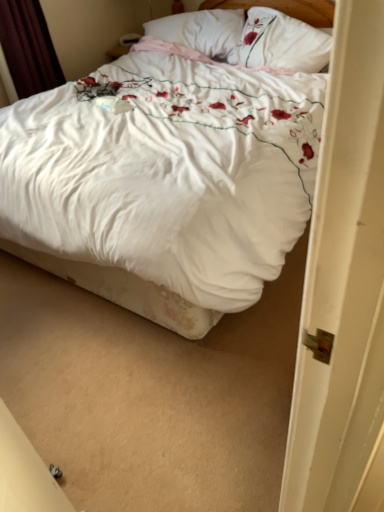
Identify the location of white floral pillow at upper center, which ranks as the second pillow in left-to-right order. The image size is (384, 512). (282, 42).

Describe the element at coordinates (282, 42) in the screenshot. This screenshot has width=384, height=512. I see `white floral pillow at upper center, placed as the first pillow when sorted from right to left` at that location.

The width and height of the screenshot is (384, 512). Find the location of `dark red velvet curtain at upper left`. dark red velvet curtain at upper left is located at coordinates (28, 47).

Find the location of a particular element. white soft pillow at upper center, which appears as the second pillow when viewed from the right is located at coordinates (202, 32).

Are white floral duvet at center and white floral pillow at upper center, which ranks as the second pillow in left-to-right order, beside each other?

No, white floral duvet at center is not with white floral pillow at upper center, which ranks as the second pillow in left-to-right order.

Is point (142, 312) in front of point (261, 41)?

Yes, it is in front of point (261, 41).

Can we say white floral duvet at center lies outside white floral pillow at upper center, which ranks as the second pillow in left-to-right order?

Yes.

Between white floral duvet at center and white soft pillow at upper center, which is the 1th pillow in left-to-right order, which one appears on the right side from the viewer's perspective?

white soft pillow at upper center, which is the 1th pillow in left-to-right order, is more to the right.

Considering the relative positions of white floral duvet at center and white soft pillow at upper center, which is the 1th pillow in left-to-right order, in the image provided, is white floral duvet at center in front of white soft pillow at upper center, which is the 1th pillow in left-to-right order,?

Yes, white floral duvet at center is in front of white soft pillow at upper center, which is the 1th pillow in left-to-right order.

From a real-world perspective, is white floral duvet at center physically located above or below white soft pillow at upper center, which appears as the second pillow when viewed from the right?

white floral duvet at center is below white soft pillow at upper center, which appears as the second pillow when viewed from the right.

Consider the image. Does white floral duvet at center have a lesser height compared to white soft pillow at upper center, which is the 1th pillow in left-to-right order?

Incorrect, the height of white floral duvet at center does not fall short of that of white soft pillow at upper center, which is the 1th pillow in left-to-right order.

Does white soft pillow at upper center, which is the 1th pillow in left-to-right order, turn towards dark red velvet curtain at upper left?

No, white soft pillow at upper center, which is the 1th pillow in left-to-right order, is not aimed at dark red velvet curtain at upper left.

Is the surface of white soft pillow at upper center, which is the 1th pillow in left-to-right order, in direct contact with dark red velvet curtain at upper left?

No, white soft pillow at upper center, which is the 1th pillow in left-to-right order, is not making contact with dark red velvet curtain at upper left.

Find the location of `curtain that is on the left side of white soft pillow at upper center, which appears as the second pillow when viewed from the right`. curtain that is on the left side of white soft pillow at upper center, which appears as the second pillow when viewed from the right is located at coordinates (28, 47).

From the image's perspective, is white soft pillow at upper center, which is the 1th pillow in left-to-right order, positioned above or below white floral duvet at center?

white soft pillow at upper center, which is the 1th pillow in left-to-right order, is above white floral duvet at center.

Is white soft pillow at upper center, which is the 1th pillow in left-to-right order, far away from white floral duvet at center?

white soft pillow at upper center, which is the 1th pillow in left-to-right order, is positioned a significant distance from white floral duvet at center.

Looking at this image, which object is further away from the camera, white soft pillow at upper center, which is the 1th pillow in left-to-right order, or white floral duvet at center?

white soft pillow at upper center, which is the 1th pillow in left-to-right order, is behind.

Does white soft pillow at upper center, which appears as the second pillow when viewed from the right, have a lesser height compared to white floral duvet at center?

Yes, white soft pillow at upper center, which appears as the second pillow when viewed from the right, is shorter than white floral duvet at center.

Where is `pillow lying above the white floral pillow at upper center, which ranks as the second pillow in left-to-right order (from the image's perspective)`? This screenshot has width=384, height=512. pillow lying above the white floral pillow at upper center, which ranks as the second pillow in left-to-right order (from the image's perspective) is located at coordinates (202, 32).

Does white soft pillow at upper center, which appears as the second pillow when viewed from the right, have a greater width compared to white floral pillow at upper center, placed as the first pillow when sorted from right to left?

Yes.

Is white soft pillow at upper center, which is the 1th pillow in left-to-right order, closer to the viewer compared to white floral pillow at upper center, which ranks as the second pillow in left-to-right order?

That is False.

Which is behind, point (34, 33) or point (309, 12)?

Point (34, 33)

Does dark red velvet curtain at upper left have a greater height compared to white floral duvet at center?

Incorrect, the height of dark red velvet curtain at upper left is not larger of that of white floral duvet at center.

Would you say dark red velvet curtain at upper left contains white floral duvet at center?

That's incorrect, white floral duvet at center is not inside dark red velvet curtain at upper left.

From a real-world perspective, is dark red velvet curtain at upper left over white floral duvet at center?

Yes, from a real-world perspective, dark red velvet curtain at upper left is above white floral duvet at center.

From a real-world perspective, is white floral pillow at upper center, which ranks as the second pillow in left-to-right order, above or below dark red velvet curtain at upper left?

From a real-world perspective, white floral pillow at upper center, which ranks as the second pillow in left-to-right order, is physically above dark red velvet curtain at upper left.

Where is `curtain that appears behind the white floral pillow at upper center, which ranks as the second pillow in left-to-right order`? curtain that appears behind the white floral pillow at upper center, which ranks as the second pillow in left-to-right order is located at coordinates (28, 47).

Which is behind, point (311, 42) or point (9, 68)?

Positioned behind is point (9, 68).

Can you confirm if white floral pillow at upper center, which ranks as the second pillow in left-to-right order, is bigger than dark red velvet curtain at upper left?

No.

You are a GUI agent. You are given a task and a screenshot of the screen. Output one action in this format:
    pyautogui.click(x=<x>, y=<y>)
    Task: Click on the bed that is in front of the white floral pillow at upper center, placed as the first pillow when sorted from right to left
    
    Given the screenshot: What is the action you would take?
    pyautogui.click(x=125, y=292)

Locate an element on the screen. Image resolution: width=384 pixels, height=512 pixels. the 2nd pillow positioned above the white floral duvet at center (from the image's perspective) is located at coordinates (202, 32).

Considering their positions, is white soft pillow at upper center, which is the 1th pillow in left-to-right order, positioned closer to white floral duvet at center than white floral pillow at upper center, which ranks as the second pillow in left-to-right order?

white floral pillow at upper center, which ranks as the second pillow in left-to-right order, is positioned closer to the anchor white floral duvet at center.

Looking at the image, which one is located further to white floral duvet at center, dark red velvet curtain at upper left or white floral pillow at upper center, placed as the first pillow when sorted from right to left?

Among the two, white floral pillow at upper center, placed as the first pillow when sorted from right to left, is located further to white floral duvet at center.

Based on the photo, considering their positions, is white floral duvet at center positioned further to white soft pillow at upper center, which appears as the second pillow when viewed from the right, than dark red velvet curtain at upper left?

Among the two, white floral duvet at center is located further to white soft pillow at upper center, which appears as the second pillow when viewed from the right.

From the picture: From the image, which object appears to be nearer to white floral duvet at center, white soft pillow at upper center, which is the 1th pillow in left-to-right order, or dark red velvet curtain at upper left?

Among the two, dark red velvet curtain at upper left is located nearer to white floral duvet at center.

When comparing their distances from dark red velvet curtain at upper left, does white floral duvet at center or white soft pillow at upper center, which appears as the second pillow when viewed from the right, seem closer?

white soft pillow at upper center, which appears as the second pillow when viewed from the right, is closer to dark red velvet curtain at upper left.

Which object lies nearer to the anchor point dark red velvet curtain at upper left, white soft pillow at upper center, which is the 1th pillow in left-to-right order, or white floral duvet at center?

Based on the image, white soft pillow at upper center, which is the 1th pillow in left-to-right order, appears to be nearer to dark red velvet curtain at upper left.

Considering their positions, is white soft pillow at upper center, which is the 1th pillow in left-to-right order, positioned closer to white floral pillow at upper center, placed as the first pillow when sorted from right to left, than dark red velvet curtain at upper left?

Among the two, white soft pillow at upper center, which is the 1th pillow in left-to-right order, is located nearer to white floral pillow at upper center, placed as the first pillow when sorted from right to left.

Considering their positions, is dark red velvet curtain at upper left positioned closer to white soft pillow at upper center, which is the 1th pillow in left-to-right order, than white floral duvet at center?

dark red velvet curtain at upper left is positioned closer to the anchor white soft pillow at upper center, which is the 1th pillow in left-to-right order.

This screenshot has width=384, height=512. I want to click on pillow located between white floral duvet at center and white soft pillow at upper center, which is the 1th pillow in left-to-right order, in the depth direction, so click(x=282, y=42).

You are a GUI agent. You are given a task and a screenshot of the screen. Output one action in this format:
    pyautogui.click(x=<x>, y=<y>)
    Task: Click on the curtain located between white floral duvet at center and white soft pillow at upper center, which appears as the second pillow when viewed from the right, in the depth direction
    The image size is (384, 512).
    Given the screenshot: What is the action you would take?
    pyautogui.click(x=28, y=47)

Find the location of a particular element. The height and width of the screenshot is (512, 384). pillow between dark red velvet curtain at upper left and white floral pillow at upper center, placed as the first pillow when sorted from right to left is located at coordinates (202, 32).

This screenshot has width=384, height=512. I want to click on bed between dark red velvet curtain at upper left and white floral pillow at upper center, which ranks as the second pillow in left-to-right order, so click(125, 292).